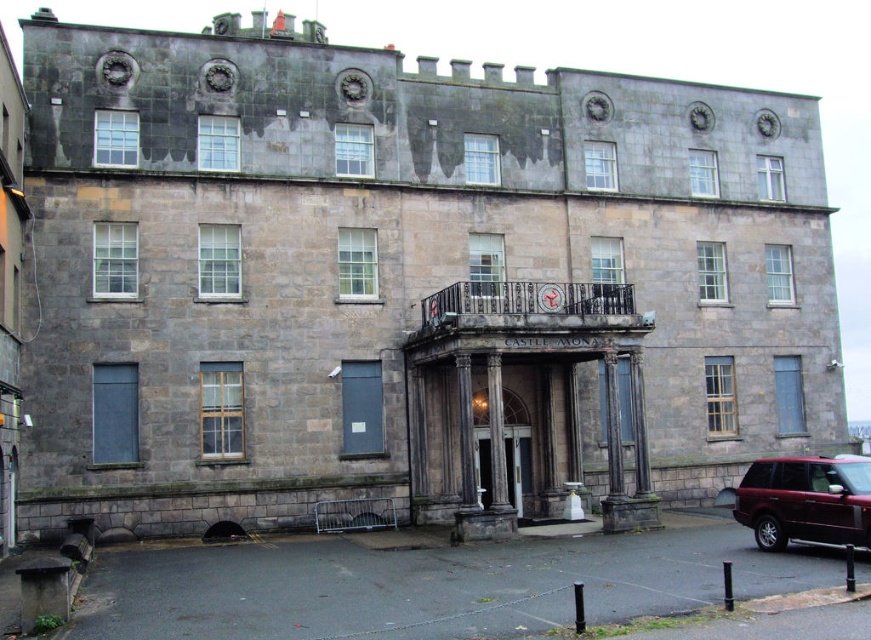
Question: Is shiny maroon suv at lower right to the right of polished stone door at center from the viewer's perspective?

Choices:
 (A) yes
 (B) no

Answer: (A)

Question: Is shiny maroon suv at lower right wider than polished stone door at center?

Choices:
 (A) no
 (B) yes

Answer: (B)

Question: Does shiny maroon suv at lower right lie behind polished stone door at center?

Choices:
 (A) yes
 (B) no

Answer: (B)